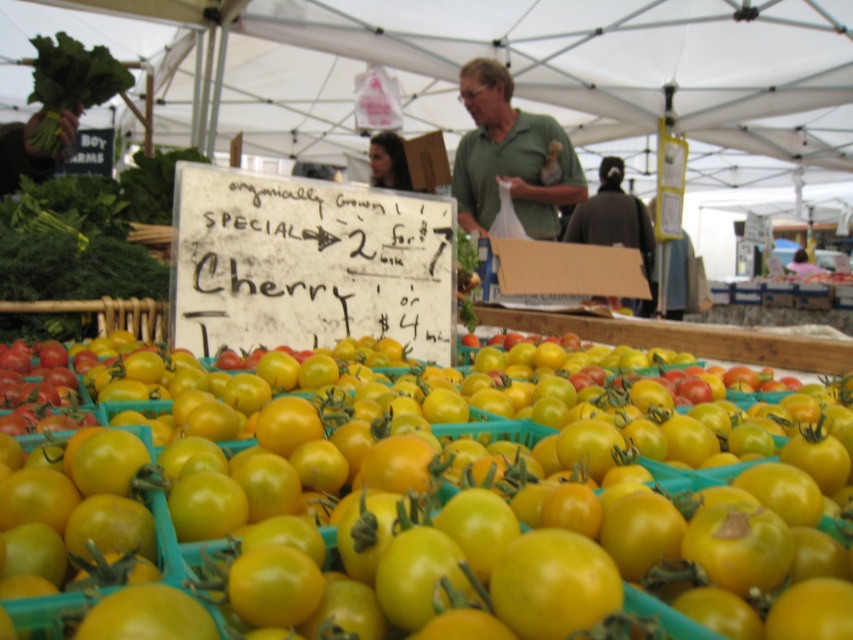
Question: Which point is farther to the camera?

Choices:
 (A) green leafy at upper left
 (B) dark brown sweater at center
 (C) shiny yellow tomato at center

Answer: (B)

Question: Among these points, which one is nearest to the camera?

Choices:
 (A) (560, 577)
 (B) (608, 180)
 (C) (41, 45)

Answer: (A)

Question: Does green matte shirt at center appear over dark brown sweater at center?

Choices:
 (A) no
 (B) yes

Answer: (B)

Question: In this image, where is shiny yellow tomato at center located relative to green matte shirt at center?

Choices:
 (A) above
 (B) below

Answer: (B)

Question: Which point appears farthest from the camera in this image?

Choices:
 (A) (572, 209)
 (B) (616, 470)
 (C) (33, 97)
 (D) (469, 154)

Answer: (A)

Question: From the image, what is the correct spatial relationship of green leafy at upper left in relation to dark brown sweater at center?

Choices:
 (A) left
 (B) right

Answer: (A)